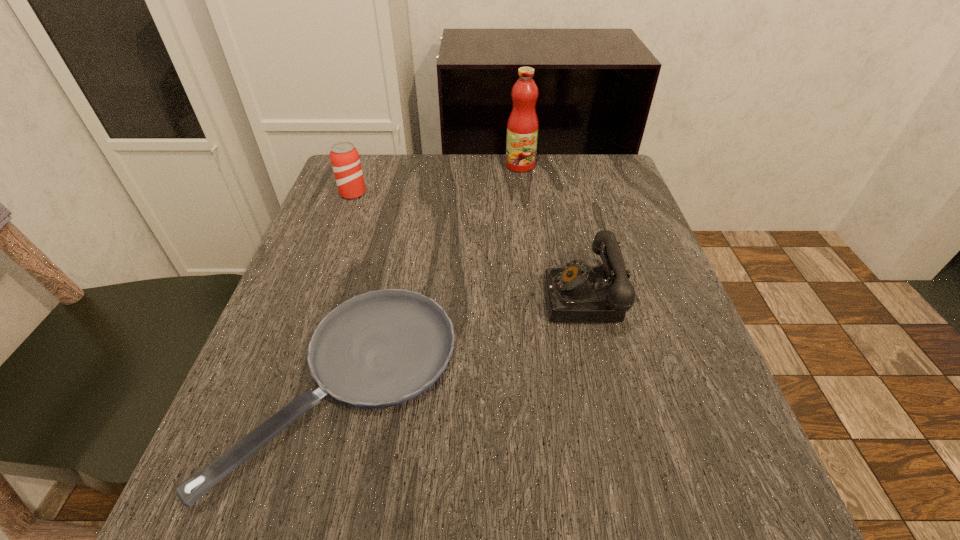
Identify the location of the tallest object. (522, 128).

Locate an element on the screen. fruit juice is located at coordinates (522, 128).

Locate an element on the screen. The height and width of the screenshot is (540, 960). beer can is located at coordinates (344, 157).

Locate an element on the screen. This screenshot has height=540, width=960. telephone is located at coordinates (576, 293).

In order to click on frying pan in this screenshot , I will do `click(381, 348)`.

You are a GUI agent. You are given a task and a screenshot of the screen. Output one action in this format:
    pyautogui.click(x=<x>, y=<y>)
    Task: Click on the vacant area situated 0.210m on the front label of the farthest object
    
    Given the screenshot: What is the action you would take?
    (x=527, y=222)

Locate an element on the screen. The height and width of the screenshot is (540, 960). vacant region located 0.050m on the front of the beer can is located at coordinates (346, 213).

Locate an element on the screen. The image size is (960, 540). vacant space situated 0.150m on the dial of the telephone is located at coordinates (465, 298).

This screenshot has width=960, height=540. I want to click on free location located 0.110m on the dial of the telephone, so click(486, 298).

The width and height of the screenshot is (960, 540). What are the coordinates of `free space located on the dial of the telephone` in the screenshot? It's located at (384, 298).